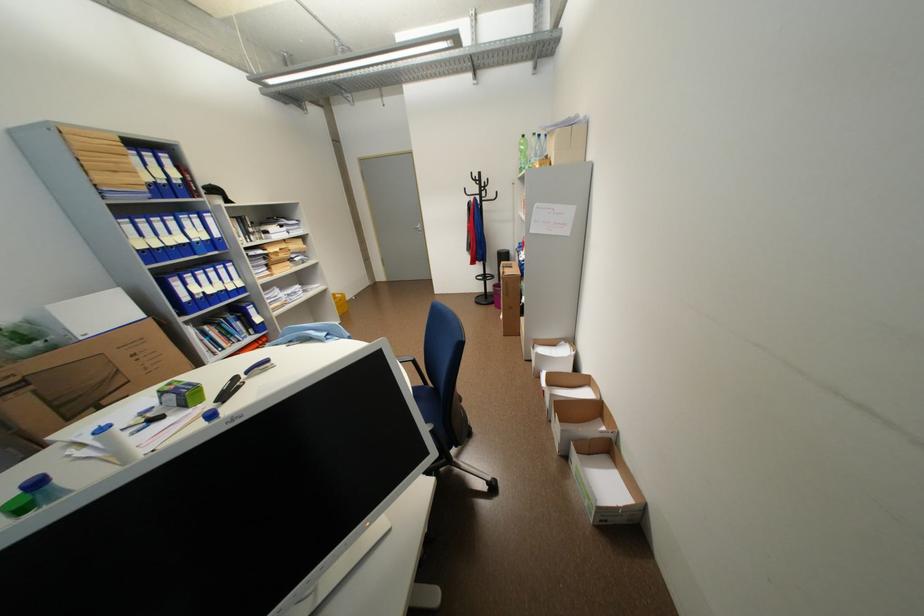
What do you see at coordinates (475, 177) in the screenshot? The height and width of the screenshot is (616, 924). I see `the coat rack hook` at bounding box center [475, 177].